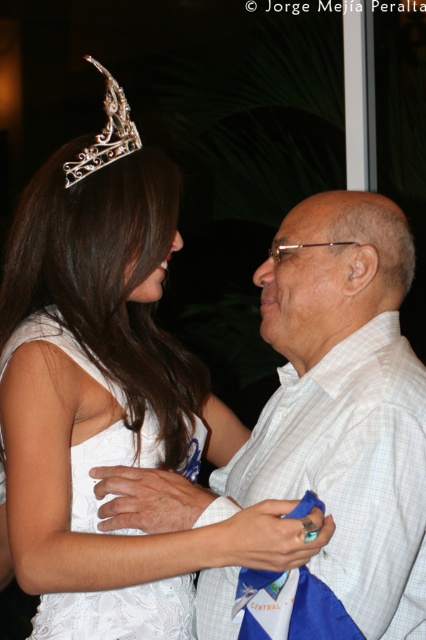
You are a photographer at the event and need to ensure both the white checkered shirt at center and the matte gold forehead at center are clearly visible in your photo. Given their sizes, which object should you focus on first to ensure clarity?

The white checkered shirt at center is larger in size than the matte gold forehead at center, so focusing on the white checkered shirt at center first will ensure both are in focus since it is the larger object.